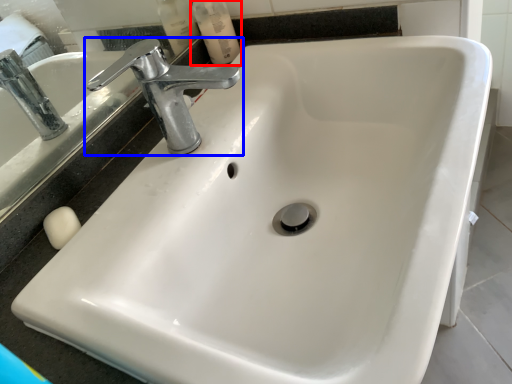
Question: Which object appears closest to the camera in this image, mouthwash (highlighted by a red box) or tap (highlighted by a blue box)?

Choices:
 (A) mouthwash
 (B) tap

Answer: (B)